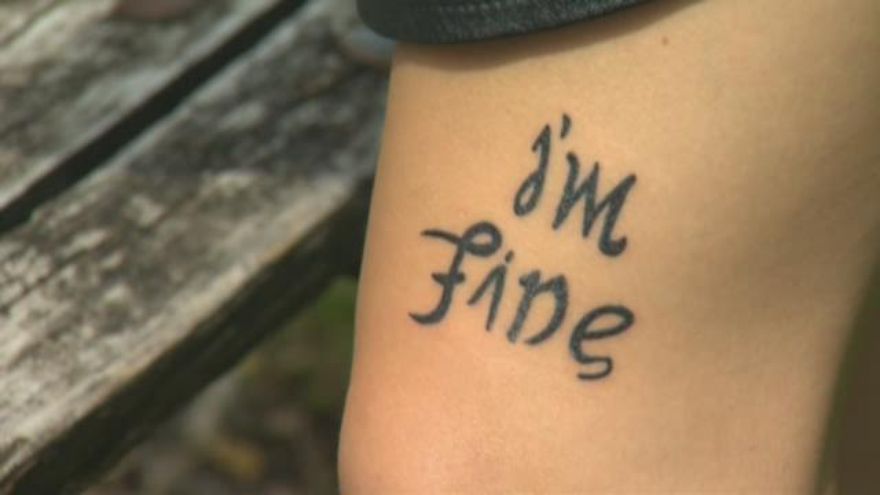
This screenshot has height=495, width=880. In order to click on grey wooden bench in this screenshot , I will do `click(291, 144)`.